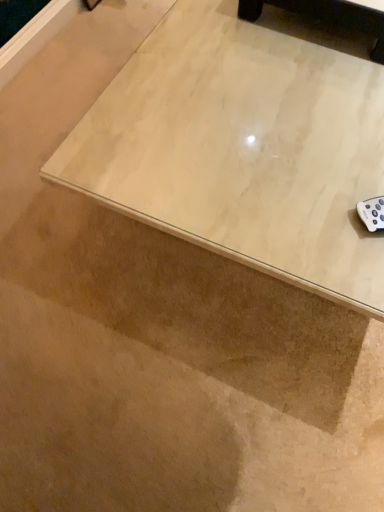
Question: From the image's perspective, is light wood table at upper right above or below light wood coffee table at upper center?

Choices:
 (A) below
 (B) above

Answer: (A)

Question: Is point (226, 5) positioned closer to the camera than point (281, 5)?

Choices:
 (A) farther
 (B) closer

Answer: (A)

Question: In terms of size, does light wood table at upper right appear bigger or smaller than light wood coffee table at upper center?

Choices:
 (A) big
 (B) small

Answer: (A)

Question: Based on their sizes in the image, would you say light wood coffee table at upper center is bigger or smaller than light wood table at upper right?

Choices:
 (A) big
 (B) small

Answer: (B)

Question: Is light wood coffee table at upper center wider or thinner than light wood table at upper right?

Choices:
 (A) thin
 (B) wide

Answer: (A)

Question: From a real-world perspective, is light wood coffee table at upper center physically located above or below light wood table at upper right?

Choices:
 (A) above
 (B) below

Answer: (A)

Question: In the image, is light wood coffee table at upper center on the left side or the right side of light wood table at upper right?

Choices:
 (A) right
 (B) left

Answer: (B)